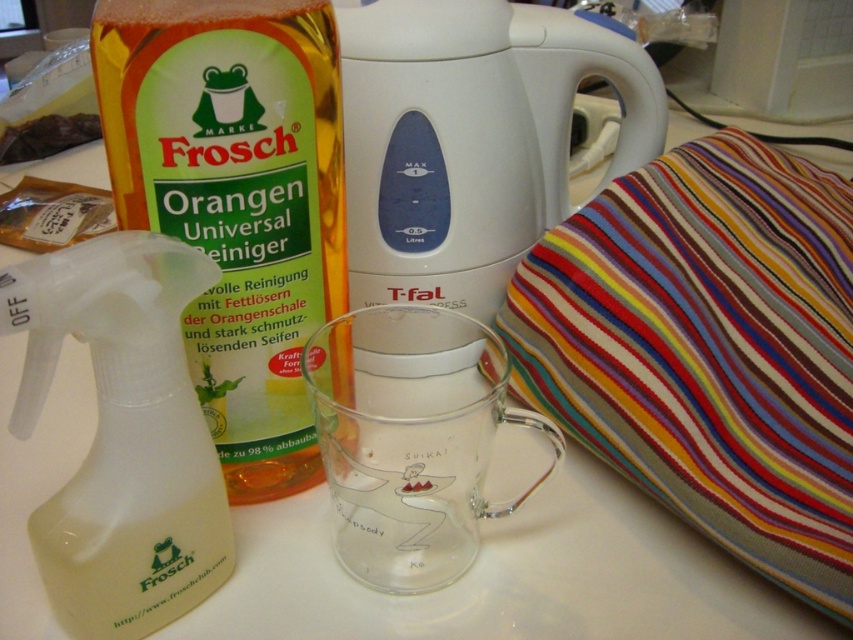
Who is taller, yellow-orange liquid at left or white plastic jug at center?

With more height is yellow-orange liquid at left.

The width and height of the screenshot is (853, 640). Find the location of `yellow-orange liquid at left`. yellow-orange liquid at left is located at coordinates (235, 202).

Is yellow-orange liquid at left to the right of transparent plastic spray bottle at left from the viewer's perspective?

Correct, you'll find yellow-orange liquid at left to the right of transparent plastic spray bottle at left.

Describe the element at coordinates (235, 202) in the screenshot. Image resolution: width=853 pixels, height=640 pixels. I see `yellow-orange liquid at left` at that location.

Is point (289, 408) farther from camera compared to point (22, 381)?

Yes, it is behind point (22, 381).

What are the coordinates of `yellow-orange liquid at left` in the screenshot? It's located at (235, 202).

Does striped fabric cushion at right have a greater height compared to white plastic jug at center?

Yes.

Does striped fabric cushion at right appear under white plastic jug at center?

Indeed, striped fabric cushion at right is positioned under white plastic jug at center.

What do you see at coordinates (708, 349) in the screenshot?
I see `striped fabric cushion at right` at bounding box center [708, 349].

You are a GUI agent. You are given a task and a screenshot of the screen. Output one action in this format:
    pyautogui.click(x=<x>, y=<y>)
    Task: Click on the striped fabric cushion at right
    This screenshot has width=853, height=640.
    Given the screenshot: What is the action you would take?
    pyautogui.click(x=708, y=349)